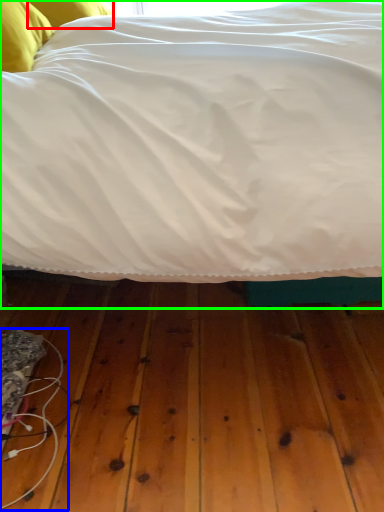
Question: Considering the real-world distances, which object is farthest from pillow (highlighted by a red box)? wire (highlighted by a blue box) or bed (highlighted by a green box)?

Choices:
 (A) wire
 (B) bed

Answer: (A)